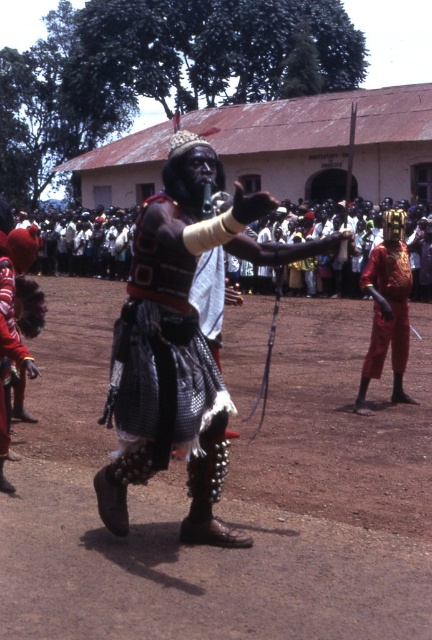
Question: Which point appears farthest from the camera in this image?

Choices:
 (A) (168, 291)
 (B) (402, 620)

Answer: (A)

Question: Does brown dirt field at center appear on the left side of red fabric skirt at lower left?

Choices:
 (A) no
 (B) yes

Answer: (A)

Question: Estimate the real-world distances between objects in this image. Which object is farther from the shiny gold armor at right?

Choices:
 (A) black leather vest at center
 (B) brown dirt field at center
 (C) textured fabric skirt at center

Answer: (C)

Question: Which of the following is the closest to the observer?

Choices:
 (A) textured fabric skirt at center
 (B) brown dirt field at center
 (C) red fabric skirt at lower left

Answer: (B)

Question: Does textured fabric skirt at center appear on the left side of red fabric skirt at lower left?

Choices:
 (A) no
 (B) yes

Answer: (A)

Question: Does brown dirt field at center have a greater width compared to red fabric skirt at lower left?

Choices:
 (A) no
 (B) yes

Answer: (B)